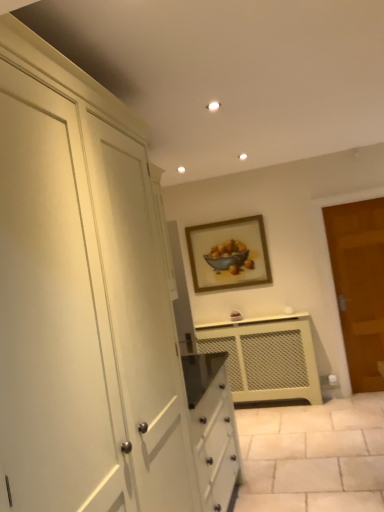
What is the approximate height of wooden-framed painting at center?

It is 29.71 inches.

What do you see at coordinates (359, 286) in the screenshot?
I see `brown wooden door at right` at bounding box center [359, 286].

What are the coordinates of `wooden-framed painting at center` in the screenshot? It's located at (228, 254).

Is brown wooden door at right behind wooden-framed painting at center?

No, it is not.

Considering the sizes of objects brown wooden door at right and wooden-framed painting at center in the image provided, who is shorter, brown wooden door at right or wooden-framed painting at center?

Standing shorter between the two is wooden-framed painting at center.

How far apart are brown wooden door at right and wooden-framed painting at center?

A distance of 1.04 meters exists between brown wooden door at right and wooden-framed painting at center.

Where is `picture frame on the left of brown wooden door at right`? picture frame on the left of brown wooden door at right is located at coordinates (228, 254).

From a real-world perspective, is matte cream radiator at center located higher than wooden-framed painting at center?

No, from a real-world perspective, matte cream radiator at center is not over wooden-framed painting at center

In terms of height, does matte cream radiator at center look taller or shorter compared to wooden-framed painting at center?

matte cream radiator at center is taller than wooden-framed painting at center.

Locate an element on the screen. picture frame on the left of the matte cream radiator at center is located at coordinates (228, 254).

In the image, there is a wooden-framed painting at center. Find the location of `door below it (from a real-world perspective)`. door below it (from a real-world perspective) is located at coordinates pyautogui.click(x=359, y=286).

Is wooden-framed painting at center oriented away from brown wooden door at right?

No, wooden-framed painting at center is not facing away from brown wooden door at right.

Considering the relative sizes of wooden-framed painting at center and brown wooden door at right in the image provided, is wooden-framed painting at center smaller than brown wooden door at right?

Yes, wooden-framed painting at center is smaller than brown wooden door at right.

From the image's perspective, is wooden-framed painting at center located above or below brown wooden door at right?

wooden-framed painting at center is above brown wooden door at right.

Considering the relative positions of matte cream radiator at center and brown wooden door at right in the image provided, is matte cream radiator at center to the left of brown wooden door at right from the viewer's perspective?

Correct, you'll find matte cream radiator at center to the left of brown wooden door at right.

Is brown wooden door at right at the back of matte cream radiator at center?

Result: That's not correct — matte cream radiator at center is not looking away from brown wooden door at right.

Is matte cream radiator at center not close to brown wooden door at right?

That's not correct — matte cream radiator at center is a little close to brown wooden door at right.

Based on the photo, considering the relative sizes of wooden-framed painting at center and matte cream radiator at center in the image provided, is wooden-framed painting at center taller than matte cream radiator at center?

No, wooden-framed painting at center is not taller than matte cream radiator at center.

Is wooden-framed painting at center next to matte cream radiator at center and touching it?

No, wooden-framed painting at center is not touching matte cream radiator at center.

Measure the distance between wooden-framed painting at center and matte cream radiator at center.

wooden-framed painting at center is 75.65 centimeters away from matte cream radiator at center.

From a real-world perspective, between wooden-framed painting at center and matte cream radiator at center, who is vertically higher?

wooden-framed painting at center, from a real-world perspective.

From a real-world perspective, who is located higher, brown wooden door at right or matte cream radiator at center?

brown wooden door at right.

Would you say brown wooden door at right contains matte cream radiator at center?

No.

Who is more distant, brown wooden door at right or matte cream radiator at center?

matte cream radiator at center is more distant.

Which is less distant, (342, 317) or (239, 381)?

Point (342, 317)

Where is `picture frame lying on the left of brown wooden door at right`? picture frame lying on the left of brown wooden door at right is located at coordinates (228, 254).

You are a GUI agent. You are given a task and a screenshot of the screen. Output one action in this format:
    pyautogui.click(x=<x>, y=<y>)
    Task: Click on the picture frame above the matte cream radiator at center (from the image's perspective)
    
    Given the screenshot: What is the action you would take?
    pyautogui.click(x=228, y=254)

Considering their positions, is brown wooden door at right positioned closer to wooden-framed painting at center than matte cream radiator at center?

Among the two, matte cream radiator at center is located nearer to wooden-framed painting at center.

Based on their spatial positions, is matte cream radiator at center or wooden-framed painting at center further from brown wooden door at right?

Based on the image, wooden-framed painting at center appears to be further to brown wooden door at right.

Looking at this image, when comparing their distances from brown wooden door at right, does wooden-framed painting at center or matte cream radiator at center seem further?

wooden-framed painting at center is further to brown wooden door at right.

Based on their spatial positions, is wooden-framed painting at center or brown wooden door at right further from matte cream radiator at center?

brown wooden door at right is further to matte cream radiator at center.

Which object lies nearer to the anchor point matte cream radiator at center, brown wooden door at right or wooden-framed painting at center?

Based on the image, wooden-framed painting at center appears to be nearer to matte cream radiator at center.

In the scene shown: From the image, which object appears to be nearer to wooden-framed painting at center, matte cream radiator at center or brown wooden door at right?

Answer: Among the two, matte cream radiator at center is located nearer to wooden-framed painting at center.

Identify the location of cabinetry situated between wooden-framed painting at center and brown wooden door at right from left to right. (266, 357).